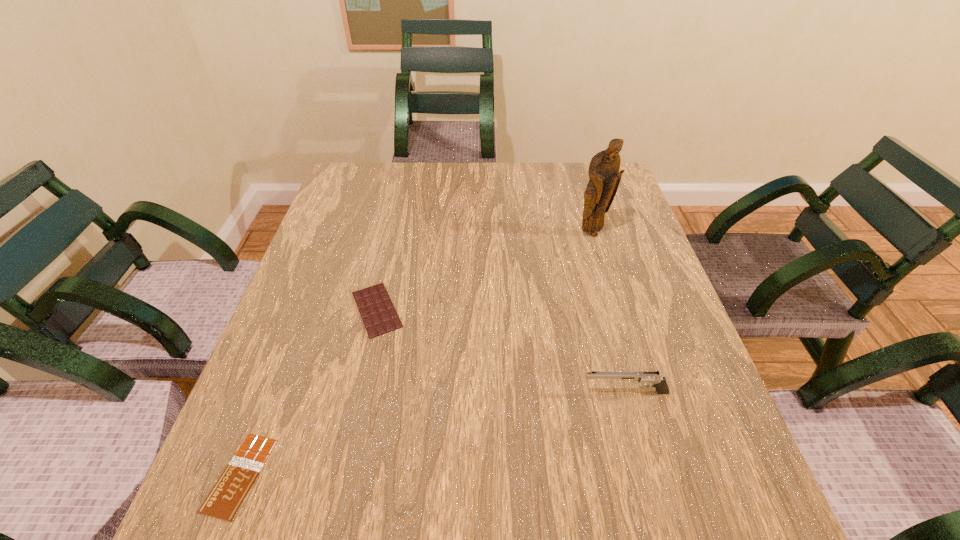
The width and height of the screenshot is (960, 540). What are the coordinates of `the tallest object` in the screenshot? It's located at (604, 174).

Image resolution: width=960 pixels, height=540 pixels. Identify the location of the farthest object. (604, 174).

I want to click on pistol, so click(x=659, y=382).

Locate an element on the screen. the third farthest object is located at coordinates (659, 382).

This screenshot has height=540, width=960. Find the location of `the taller chocolate bar`. the taller chocolate bar is located at coordinates (377, 311).

Find the location of `the third object from right to left`. the third object from right to left is located at coordinates pos(377,311).

You are a GUI agent. You are given a task and a screenshot of the screen. Output one action in this format:
    pyautogui.click(x=<x>, y=<y>)
    Task: Click on the leftmost object
    The image size is (960, 540).
    Given the screenshot: What is the action you would take?
    pyautogui.click(x=224, y=500)

Image resolution: width=960 pixels, height=540 pixels. What are the coordinates of `the shortest object` in the screenshot? It's located at (224, 500).

At what (x,y) coordinates should I click in order to perform the action: click on vacant space located on the front-facing side of the figurine. Please return your answer as a coordinate pair (x, y). Looking at the image, I should click on (596, 251).

Image resolution: width=960 pixels, height=540 pixels. Identify the location of vacant space located on the front-facing side of the pistol. (388, 393).